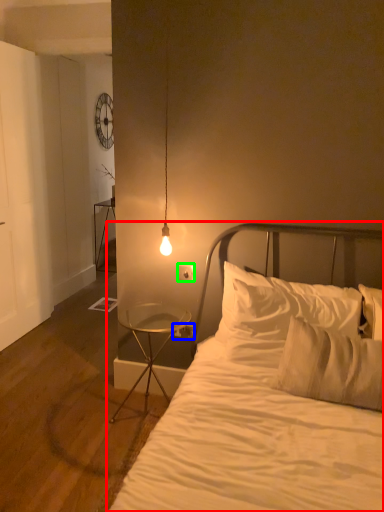
Question: Which is farther away from bed (highlighted by a red box)? electric outlet (highlighted by a blue box) or electric outlet (highlighted by a green box)?

Choices:
 (A) electric outlet
 (B) electric outlet

Answer: (A)